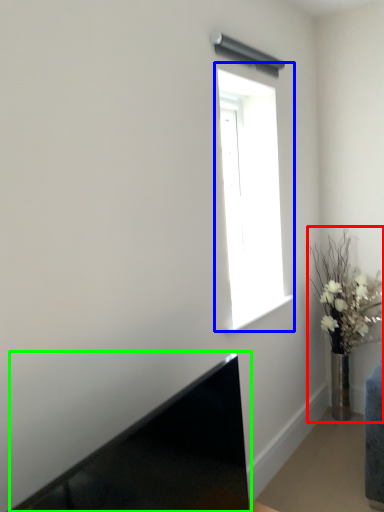
Question: Which object is positioned farthest from houseplant (highlighted by a red box)? Select from window (highlighted by a blue box) and laptop (highlighted by a green box).

Choices:
 (A) window
 (B) laptop

Answer: (B)